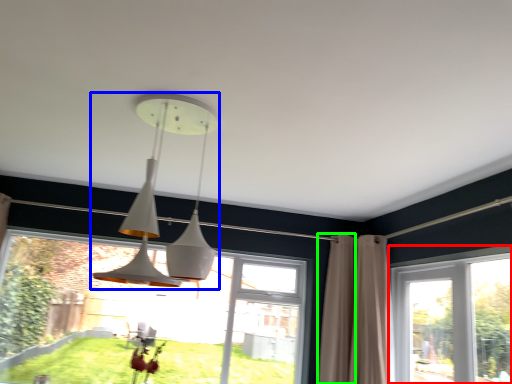
Question: Considering the real-world distances, which object is closest to window (highlighted by a red box)? lamp (highlighted by a blue box) or curtain (highlighted by a green box).

Choices:
 (A) lamp
 (B) curtain

Answer: (B)